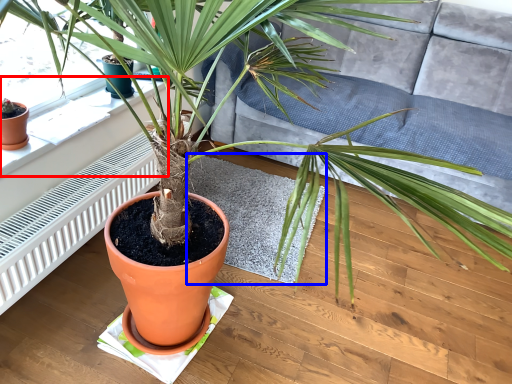
Question: Which of the following is the closest to the observer, window sill (highlighted by a red box) or mat (highlighted by a blue box)?

Choices:
 (A) window sill
 (B) mat

Answer: (A)